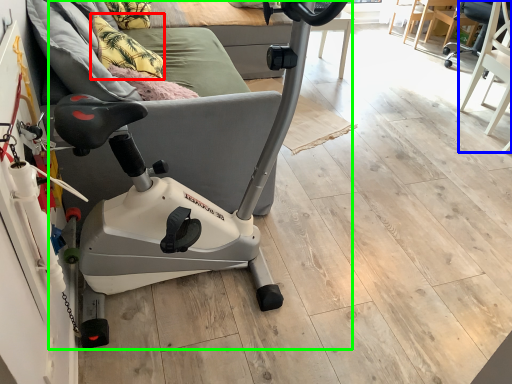
Question: Which object is positioned closest to pillow (highlighted by a red box)? Select from swivel chair (highlighted by a blue box) and stationary bicycle (highlighted by a green box).

Choices:
 (A) swivel chair
 (B) stationary bicycle

Answer: (B)